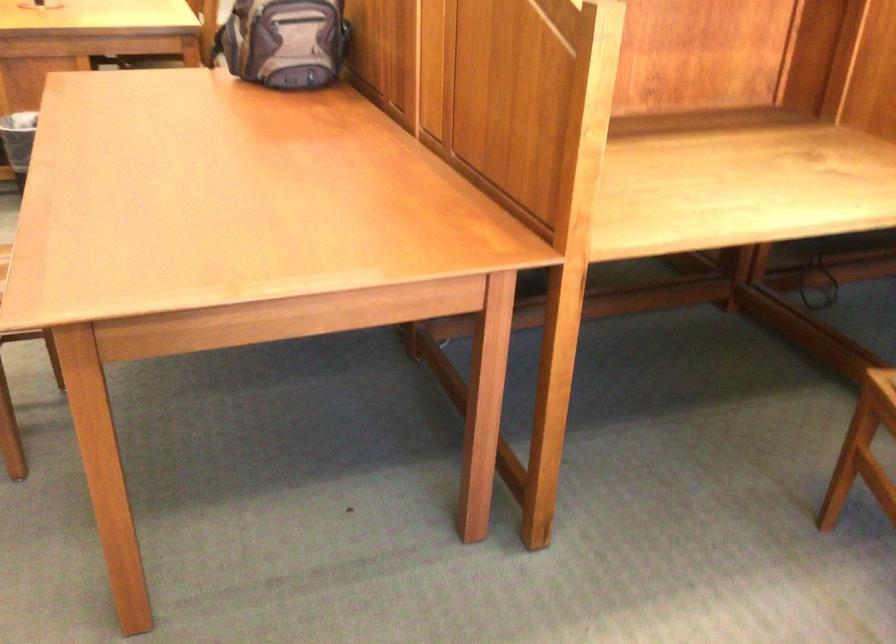
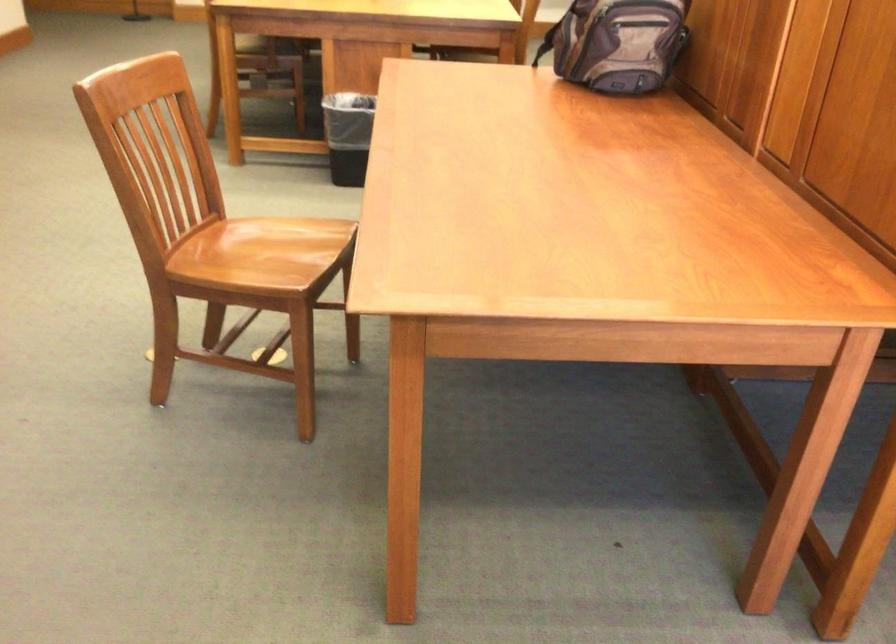
Question: How did the camera likely rotate?

Choices:
 (A) Left
 (B) Right
 (C) Up
 (D) Down

Answer: (A)